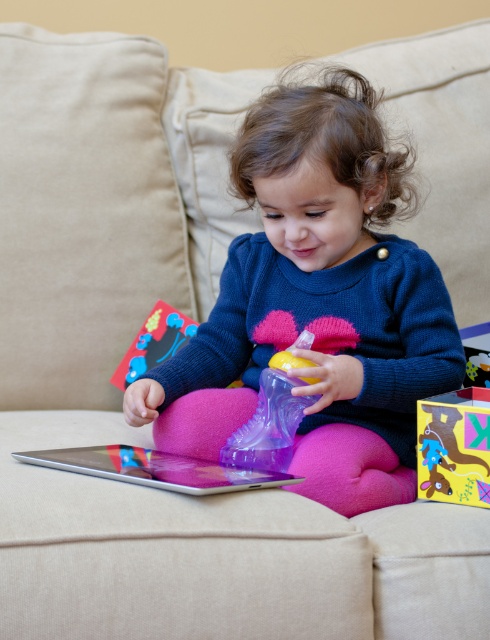
The child is sitting on a beige couch and has two items in front of them. Which item is directly below the other between the matte cardboard box at center and the matte plastic toy at center?

The matte cardboard box at center is positioned under the matte plastic toy at center, so the matte cardboard box at center is directly below the matte plastic toy at center.

You are a parent trying to organize the child area. The silver metallic tablet at lower center and the matte plastic toy at center are in the way of the path. Which object should you move to the left to clear the path?

The silver metallic tablet at lower center is to the right of the matte plastic toy at center. To clear the path, move the silver metallic tablet at lower center to the left so it aligns with or moves past the matte plastic toy at center.

You are helping organize a child play area and need to place both the matte cardboard box at center and the matte plastic toy at center on a small shelf. The shelf has limited space. Which item should you place first to ensure both fit?

You should place the matte plastic toy at center first because it takes up more space than the matte cardboard box at center, allowing the smaller box to fit alongside it on the shelf.